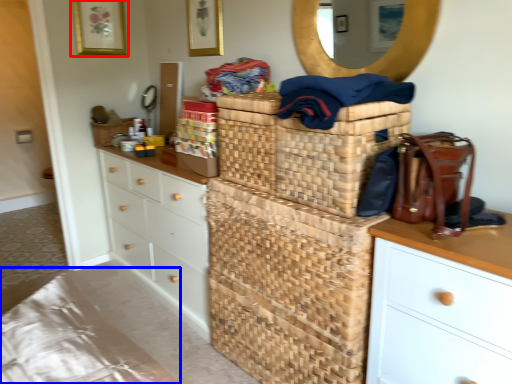
Question: Which of the following is the farthest to the observer, picture frame (highlighted by a red box) or bedding (highlighted by a blue box)?

Choices:
 (A) picture frame
 (B) bedding

Answer: (A)